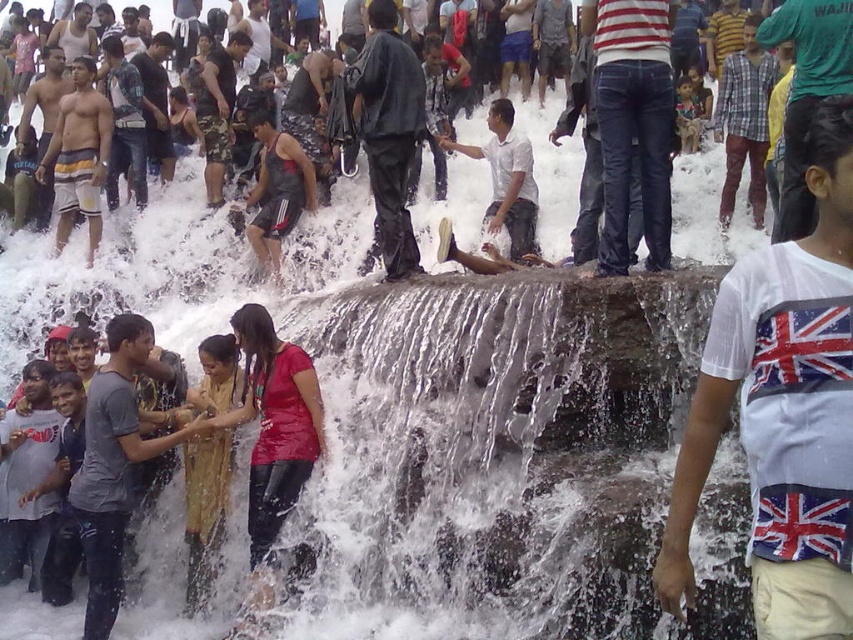
You are at the festival and want to know which clothing item is shorter between the striped shorts at left and the white cotton shirt at center. Can you tell me?

The striped shorts at left is shorter than the white cotton shirt at center.

You are standing at the point with coordinates point [508,134] and want to walk to the point with coordinates point [97,131]. Is there a clear path between these two points without any obstacles?

Point [97,131] is behind point [508,134], so there might be an obstacle blocking the path between them. You might need to go around the obstacle to reach the destination.